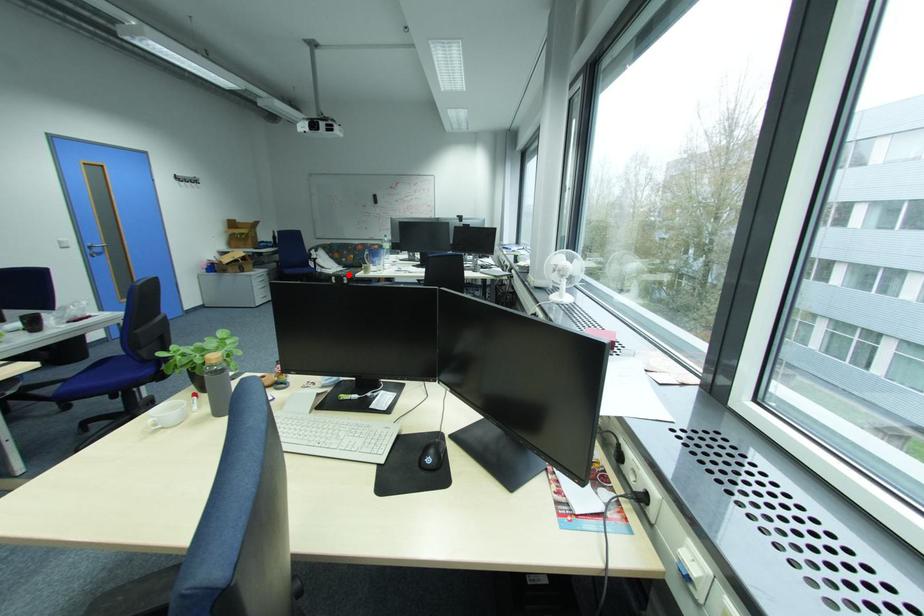
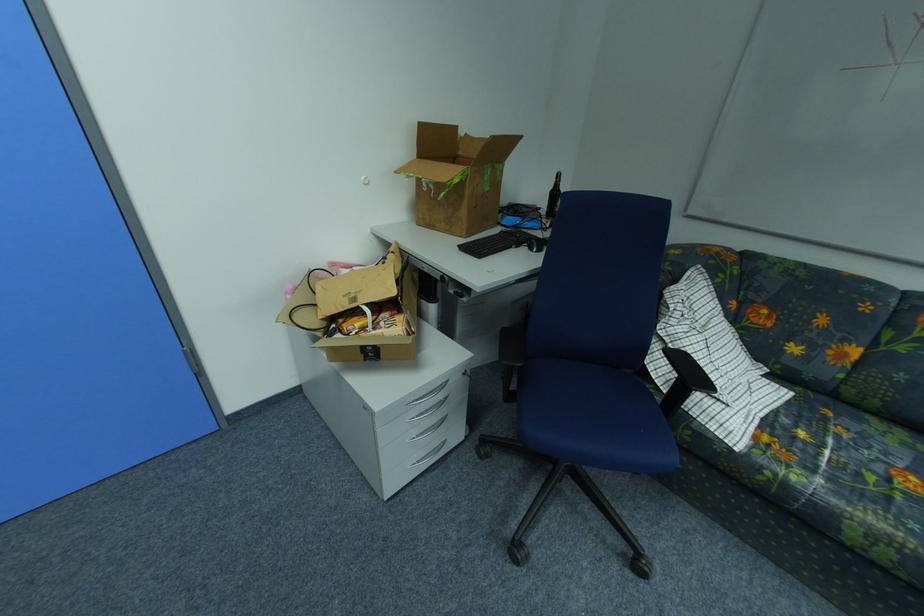
Find the pixel in the second image that matches the highlighted location in the first image.

(804, 479)